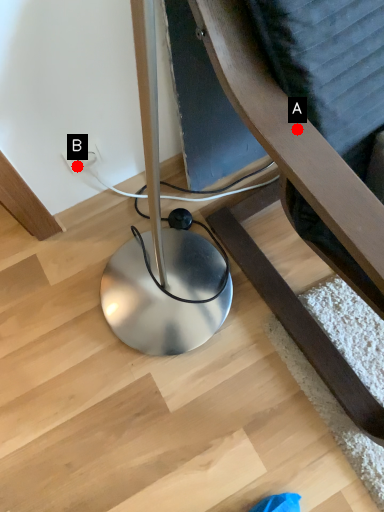
Question: Two points are circled on the image, labeled by A and B beside each circle. Which point is closer to the camera?

Choices:
 (A) A is closer
 (B) B is closer

Answer: (A)